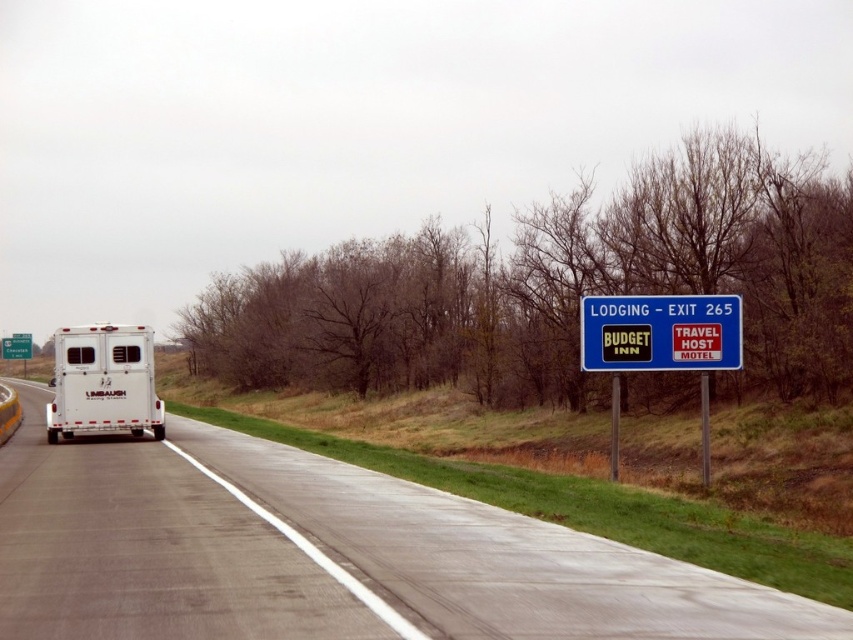
Is gray asphalt highway at center thinner than white matte horse trailer at left?

No, gray asphalt highway at center is not thinner than white matte horse trailer at left.

What do you see at coordinates (325, 554) in the screenshot?
I see `gray asphalt highway at center` at bounding box center [325, 554].

Does point (635, 627) come farther from viewer compared to point (132, 355)?

No, it is in front of (132, 355).

Locate an element on the screen. This screenshot has width=853, height=640. gray asphalt highway at center is located at coordinates (325, 554).

What do you see at coordinates (325, 554) in the screenshot? This screenshot has width=853, height=640. I see `gray asphalt highway at center` at bounding box center [325, 554].

Can you confirm if gray asphalt highway at center is shorter than blue plastic sign at right?

Yes, gray asphalt highway at center is shorter than blue plastic sign at right.

Find the location of `gray asphalt highway at center`. gray asphalt highway at center is located at coordinates (325, 554).

Does blue plastic sign at right appear under white matte horse trailer at left?

No, blue plastic sign at right is not below white matte horse trailer at left.

Does point (608, 355) come behind point (107, 339)?

No, (608, 355) is in front of (107, 339).

Locate an element on the screen. The height and width of the screenshot is (640, 853). blue plastic sign at right is located at coordinates (660, 332).